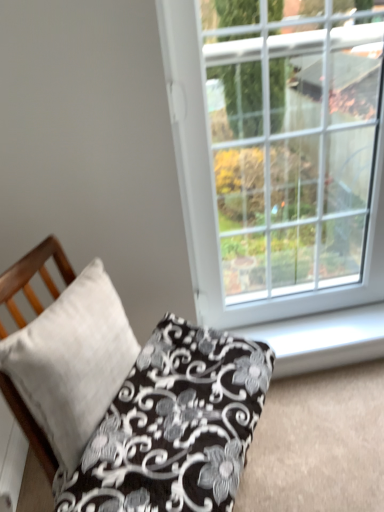
Identify the location of white plastic window sill at lower right. The width and height of the screenshot is (384, 512). (322, 339).

How much space does satin white pillow at lower left, which ranks as the 1th pillow in right-to-left order, occupy horizontally?

The width of satin white pillow at lower left, which ranks as the 1th pillow in right-to-left order, is 18.47 inches.

Measure the distance between satin white pillow at lower left, which ranks as the 1th pillow in right-to-left order, and camera.

satin white pillow at lower left, which ranks as the 1th pillow in right-to-left order, is 33.46 inches away from camera.

Describe the element at coordinates (72, 361) in the screenshot. I see `white matte pillow at left, positioned as the 2th pillow in right-to-left order` at that location.

Find the location of a particular element. The height and width of the screenshot is (512, 384). white plastic window sill at lower right is located at coordinates (322, 339).

Which of these two, white matte pillow at left, which is the first pillow from left to right, or white plastic window at upper right, stands taller?

With more height is white plastic window at upper right.

From the image's perspective, which is above, white matte pillow at left, positioned as the 2th pillow in right-to-left order, or white plastic window at upper right?

white plastic window at upper right, from the image's perspective.

Is white matte pillow at left, positioned as the 2th pillow in right-to-left order, situated inside white plastic window at upper right or outside?

white matte pillow at left, positioned as the 2th pillow in right-to-left order, is not enclosed by white plastic window at upper right.

Consider the image. How many degrees apart are the facing directions of white matte pillow at left, which is the first pillow from left to right, and white plastic window at upper right?

64.4 degrees separate the facing orientations of white matte pillow at left, which is the first pillow from left to right, and white plastic window at upper right.

Is white matte pillow at left, which is the first pillow from left to right, not inside satin white pillow at lower left, which ranks as the 1th pillow in right-to-left order?

Yes, white matte pillow at left, which is the first pillow from left to right, is outside of satin white pillow at lower left, which ranks as the 1th pillow in right-to-left order.

Is white matte pillow at left, positioned as the 2th pillow in right-to-left order, taller than satin white pillow at lower left, which is the 2th pillow in left-to-right order?

Yes.

Does white matte pillow at left, which is the first pillow from left to right, appear on the right side of satin white pillow at lower left, which ranks as the 1th pillow in right-to-left order?

Incorrect, white matte pillow at left, which is the first pillow from left to right, is not on the right side of satin white pillow at lower left, which ranks as the 1th pillow in right-to-left order.

Is white plastic window at upper right at the left side of white plastic window sill at lower right?

Indeed, white plastic window at upper right is positioned on the left side of white plastic window sill at lower right.

Can you confirm if white plastic window at upper right is wider than white plastic window sill at lower right?

No, white plastic window at upper right is not wider than white plastic window sill at lower right.

Is white plastic window at upper right facing towards white plastic window sill at lower right?

Yes, white plastic window at upper right faces towards white plastic window sill at lower right.

Is white plastic window at upper right taller or shorter than white plastic window sill at lower right?

white plastic window at upper right is taller than white plastic window sill at lower right.

Can you confirm if white plastic window at upper right is thinner than satin white pillow at lower left, which is the 2th pillow in left-to-right order?

Correct, the width of white plastic window at upper right is less than that of satin white pillow at lower left, which is the 2th pillow in left-to-right order.

In the scene shown: In the image, is white plastic window at upper right on the left side or the right side of satin white pillow at lower left, which is the 2th pillow in left-to-right order?

In the image, white plastic window at upper right appears on the right side of satin white pillow at lower left, which is the 2th pillow in left-to-right order.

Is white plastic window at upper right turned away from satin white pillow at lower left, which ranks as the 1th pillow in right-to-left order?

That's not correct — white plastic window at upper right is not looking away from satin white pillow at lower left, which ranks as the 1th pillow in right-to-left order.

What's the angular difference between white plastic window at upper right and satin white pillow at lower left, which ranks as the 1th pillow in right-to-left order,'s facing directions?

64.4 degrees separate the facing orientations of white plastic window at upper right and satin white pillow at lower left, which ranks as the 1th pillow in right-to-left order.

Is white matte pillow at left, positioned as the 2th pillow in right-to-left order, completely or partially inside satin white pillow at lower left, which is the 2th pillow in left-to-right order?

No.

From a real-world perspective, which object stands above the other?

white matte pillow at left, positioned as the 2th pillow in right-to-left order, is physically above.

Which object is closer to the camera, satin white pillow at lower left, which is the 2th pillow in left-to-right order, or white matte pillow at left, which is the first pillow from left to right?

Positioned in front is satin white pillow at lower left, which is the 2th pillow in left-to-right order.

Who is shorter, satin white pillow at lower left, which ranks as the 1th pillow in right-to-left order, or white matte pillow at left, which is the first pillow from left to right?

satin white pillow at lower left, which ranks as the 1th pillow in right-to-left order, is shorter.

Considering the sizes of objects white plastic window sill at lower right and white plastic window at upper right in the image provided, who is taller, white plastic window sill at lower right or white plastic window at upper right?

white plastic window at upper right.

Is point (241, 327) positioned after point (370, 179)?

That is True.

From the image's perspective, between white plastic window sill at lower right and white plastic window at upper right, who is located below?

From the image's view, white plastic window sill at lower right is below.

What's the angular difference between white plastic window sill at lower right and white plastic window at upper right's facing directions?

There is a 0.878-degree angle between the facing directions of white plastic window sill at lower right and white plastic window at upper right.

From the picture: Is white plastic window at upper right located within satin white pillow at lower left, which ranks as the 1th pillow in right-to-left order?

No, white plastic window at upper right is not surrounded by satin white pillow at lower left, which ranks as the 1th pillow in right-to-left order.

Consider the image. From a real-world perspective, which is physically below, satin white pillow at lower left, which is the 2th pillow in left-to-right order, or white plastic window at upper right?

From a 3D spatial view, satin white pillow at lower left, which is the 2th pillow in left-to-right order, is below.

From the picture: In terms of height, does satin white pillow at lower left, which ranks as the 1th pillow in right-to-left order, look taller or shorter compared to white plastic window at upper right?

Clearly, satin white pillow at lower left, which ranks as the 1th pillow in right-to-left order, is shorter compared to white plastic window at upper right.

In the scene shown: Is satin white pillow at lower left, which is the 2th pillow in left-to-right order, next to white plastic window at upper right?

No, satin white pillow at lower left, which is the 2th pillow in left-to-right order, is not touching white plastic window at upper right.

Where is `window above the white matte pillow at left, positioned as the 2th pillow in right-to-left order (from the image's perspective)`? The image size is (384, 512). window above the white matte pillow at left, positioned as the 2th pillow in right-to-left order (from the image's perspective) is located at coordinates (278, 153).

Locate an element on the screen. Image resolution: width=384 pixels, height=512 pixels. pillow below the white matte pillow at left, positioned as the 2th pillow in right-to-left order (from the image's perspective) is located at coordinates (174, 426).

In the scene shown: Looking at the image, which one is located closer to white matte pillow at left, positioned as the 2th pillow in right-to-left order, satin white pillow at lower left, which is the 2th pillow in left-to-right order, or white plastic window sill at lower right?

Based on the image, satin white pillow at lower left, which is the 2th pillow in left-to-right order, appears to be nearer to white matte pillow at left, positioned as the 2th pillow in right-to-left order.

Estimate the real-world distances between objects in this image. Which object is closer to white plastic window sill at lower right, satin white pillow at lower left, which is the 2th pillow in left-to-right order, or white matte pillow at left, positioned as the 2th pillow in right-to-left order?

satin white pillow at lower left, which is the 2th pillow in left-to-right order, is positioned closer to the anchor white plastic window sill at lower right.

Based on their spatial positions, is satin white pillow at lower left, which ranks as the 1th pillow in right-to-left order, or white matte pillow at left, positioned as the 2th pillow in right-to-left order, further from white plastic window at upper right?

white matte pillow at left, positioned as the 2th pillow in right-to-left order.

From the image, which object appears to be nearer to satin white pillow at lower left, which ranks as the 1th pillow in right-to-left order, white plastic window sill at lower right or white matte pillow at left, which is the first pillow from left to right?

Based on the image, white matte pillow at left, which is the first pillow from left to right, appears to be nearer to satin white pillow at lower left, which ranks as the 1th pillow in right-to-left order.

Looking at the image, which one is located closer to white plastic window at upper right, white plastic window sill at lower right or white matte pillow at left, positioned as the 2th pillow in right-to-left order?

white plastic window sill at lower right is closer to white plastic window at upper right.

Estimate the real-world distances between objects in this image. Which object is further from white plastic window at upper right, satin white pillow at lower left, which ranks as the 1th pillow in right-to-left order, or white plastic window sill at lower right?

Among the two, satin white pillow at lower left, which ranks as the 1th pillow in right-to-left order, is located further to white plastic window at upper right.

When comparing their distances from white matte pillow at left, which is the first pillow from left to right, does white plastic window sill at lower right or white plastic window at upper right seem further?

white plastic window sill at lower right lies further to white matte pillow at left, which is the first pillow from left to right, than the other object.

Which object lies further to the anchor point white plastic window sill at lower right, white matte pillow at left, which is the first pillow from left to right, or satin white pillow at lower left, which ranks as the 1th pillow in right-to-left order?

white matte pillow at left, which is the first pillow from left to right, is positioned further to the anchor white plastic window sill at lower right.

Where is `window located between satin white pillow at lower left, which ranks as the 1th pillow in right-to-left order, and white plastic window sill at lower right in the depth direction`? The width and height of the screenshot is (384, 512). window located between satin white pillow at lower left, which ranks as the 1th pillow in right-to-left order, and white plastic window sill at lower right in the depth direction is located at coordinates (278, 153).

This screenshot has height=512, width=384. I want to click on window situated between white matte pillow at left, positioned as the 2th pillow in right-to-left order, and white plastic window sill at lower right from left to right, so click(x=278, y=153).

You are a GUI agent. You are given a task and a screenshot of the screen. Output one action in this format:
    pyautogui.click(x=<x>, y=<y>)
    Task: Click on the pillow between white plastic window at upper right and satin white pillow at lower left, which is the 2th pillow in left-to-right order, in the up-down direction
    Image resolution: width=384 pixels, height=512 pixels.
    Given the screenshot: What is the action you would take?
    pyautogui.click(x=72, y=361)

Locate an element on the screen. Image resolution: width=384 pixels, height=512 pixels. pillow between satin white pillow at lower left, which is the 2th pillow in left-to-right order, and white plastic window sill at lower right in the front-back direction is located at coordinates (72, 361).